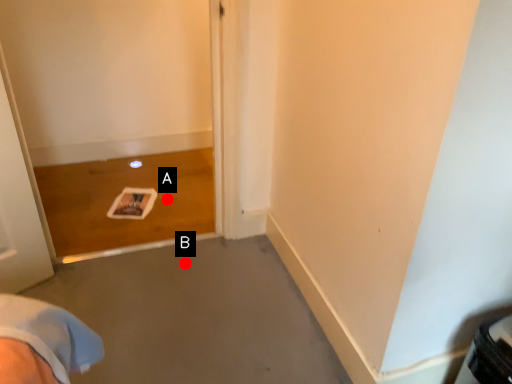
Question: Two points are circled on the image, labeled by A and B beside each circle. Which point appears farthest from the camera in this image?

Choices:
 (A) A is further
 (B) B is further

Answer: (A)